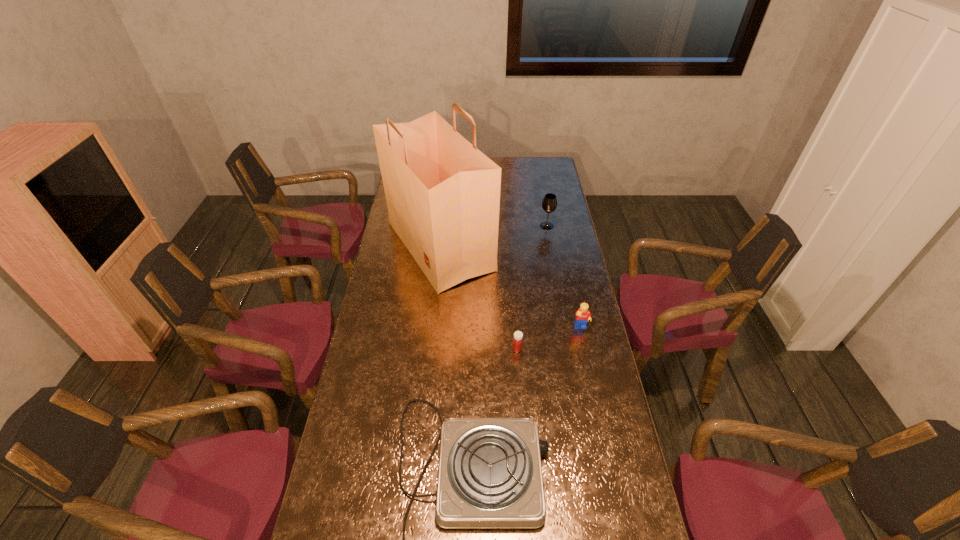
This screenshot has height=540, width=960. Identify the location of free area in between the wineglass and the second nearest object. (532, 287).

Image resolution: width=960 pixels, height=540 pixels. What are the coordinates of `the fourth closest object to the fourth farthest object` in the screenshot? It's located at (549, 204).

Locate an element on the screen. The width and height of the screenshot is (960, 540). object that is the third closest to the wineglass is located at coordinates (517, 343).

Find the location of a particular element. Image resolution: width=960 pixels, height=540 pixels. vacant region that satisfies the following two spatial constraints: 1. on the side of the second nearest object with the superhero design; 2. on the right side of the tallest object is located at coordinates (430, 349).